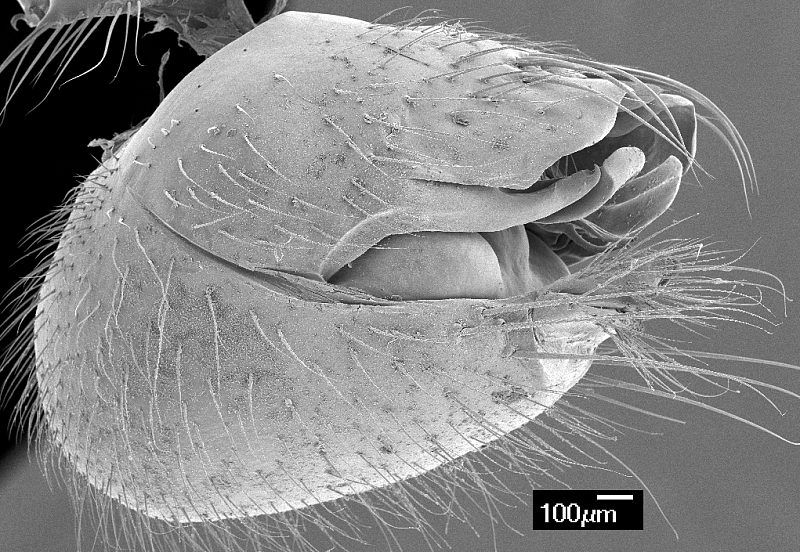
You are a GUI agent. You are given a task and a screenshot of the screen. Output one action in this format:
    pyautogui.click(x=<x>, y=<y>)
    Task: Click on the scale ruler
    The height and width of the screenshot is (552, 800).
    Given the screenshot: What is the action you would take?
    pyautogui.click(x=605, y=514)